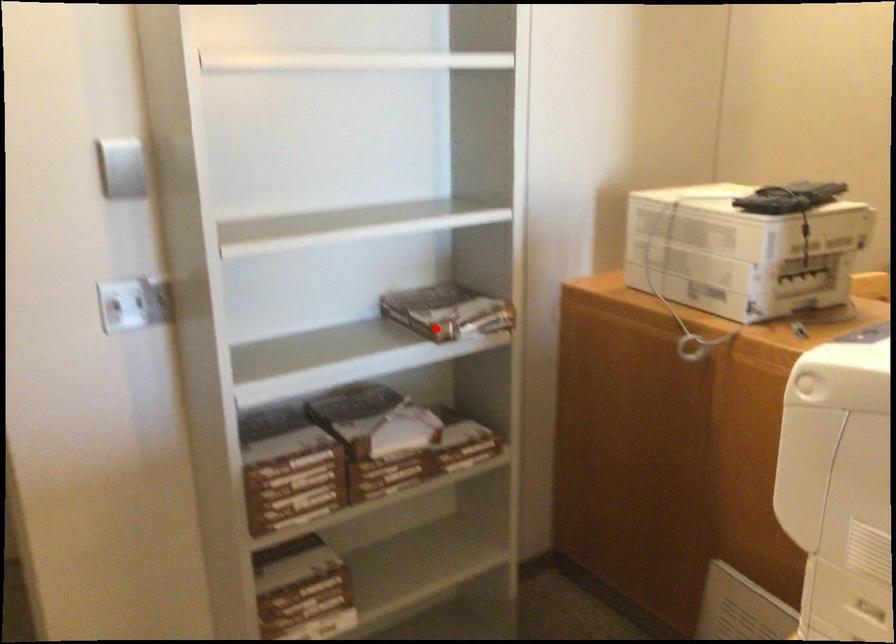
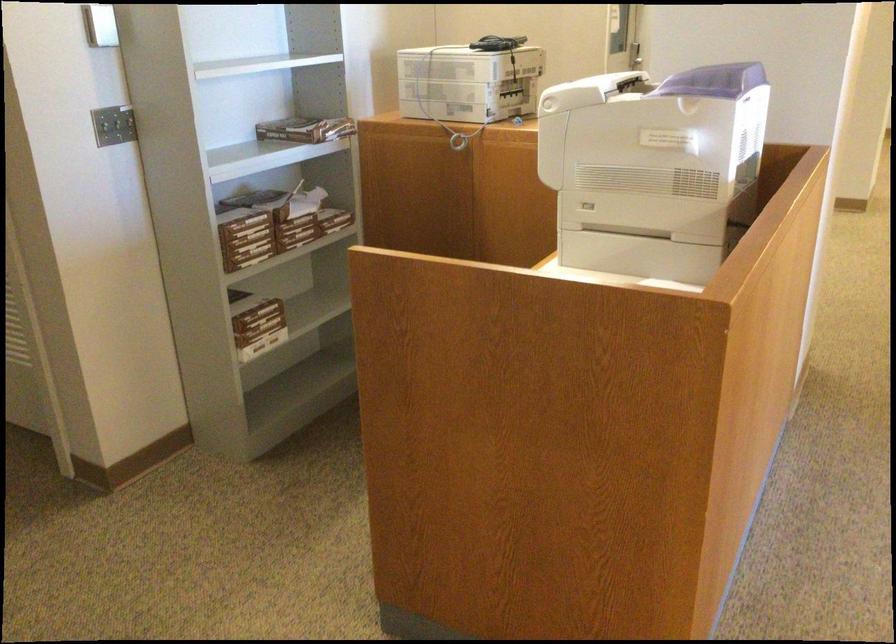
The point at the highlighted location is marked in the first image. Where is the corresponding point in the second image?

(306, 129)